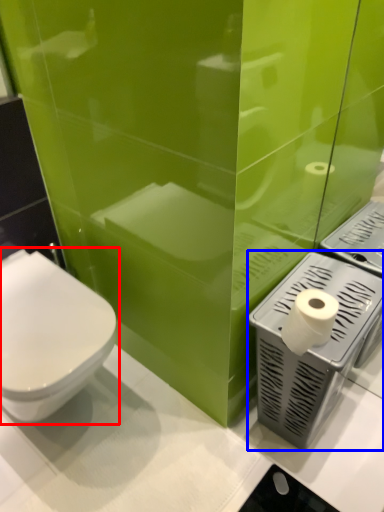
Question: Which of the following is the closest to the observer, toilet (highlighted by a red box) or appliance (highlighted by a blue box)?

Choices:
 (A) toilet
 (B) appliance

Answer: (A)